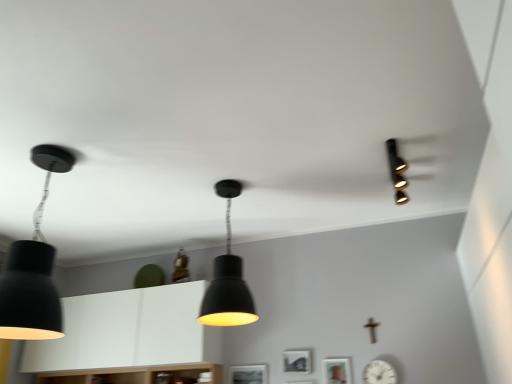
The height and width of the screenshot is (384, 512). I want to click on wooden picture frame at lower center, the 1th picture frame positioned from the right, so click(x=337, y=370).

Identify the location of white matte cabinet at center. (128, 331).

The width and height of the screenshot is (512, 384). What do you see at coordinates (297, 361) in the screenshot?
I see `black matte picture frame at center, which appears as the 2th picture frame when viewed from the right` at bounding box center [297, 361].

This screenshot has width=512, height=384. I want to click on matte black lampshade at center, acting as the second lamp starting from the left, so click(227, 277).

Describe the element at coordinates (249, 374) in the screenshot. The height and width of the screenshot is (384, 512). I see `matte black picture frame at center, the third picture frame in the right-to-left sequence` at that location.

This screenshot has width=512, height=384. In order to click on matte black picture frame at center, the third picture frame in the right-to-left sequence in this screenshot , I will do `click(249, 374)`.

Image resolution: width=512 pixels, height=384 pixels. Describe the element at coordinates (34, 268) in the screenshot. I see `matte black pendant light at left, the first lamp positioned from the left` at that location.

Image resolution: width=512 pixels, height=384 pixels. Describe the element at coordinates (379, 373) in the screenshot. I see `white matte clock at lower right` at that location.

Image resolution: width=512 pixels, height=384 pixels. Find the location of `wooden picture frame at lower center, which is the third picture frame from left to right`. wooden picture frame at lower center, which is the third picture frame from left to right is located at coordinates (337, 370).

Who is smaller, wooden picture frame at lower center, the 1th picture frame positioned from the right, or matte black lampshade at center, which is the second lamp in right-to-left order?

wooden picture frame at lower center, the 1th picture frame positioned from the right, is smaller.

Considering the points (325, 376) and (218, 284), which point is behind, point (325, 376) or point (218, 284)?

Positioned behind is point (325, 376).

From a real-world perspective, is wooden picture frame at lower center, the 1th picture frame positioned from the right, on top of matte black lampshade at center, which is the second lamp in right-to-left order?

Incorrect, from a real-world perspective, wooden picture frame at lower center, the 1th picture frame positioned from the right, is lower than matte black lampshade at center, which is the second lamp in right-to-left order.

Could you tell me if matte black spotlight at upper right, which is counted as the third lamp, starting from the left, is turned towards black matte picture frame at center, placed as the 2th picture frame when sorted from left to right?

No.

From a real-world perspective, is matte black spotlight at upper right, which is counted as the third lamp, starting from the left, over black matte picture frame at center, placed as the 2th picture frame when sorted from left to right?

Indeed, from a real-world perspective, matte black spotlight at upper right, which is counted as the third lamp, starting from the left, stands above black matte picture frame at center, placed as the 2th picture frame when sorted from left to right.

Between matte black spotlight at upper right, the 1th lamp in the right-to-left sequence, and black matte picture frame at center, placed as the 2th picture frame when sorted from left to right, which one has smaller width?

black matte picture frame at center, placed as the 2th picture frame when sorted from left to right, is thinner.

From the matte black spotlight at upper right, which is counted as the third lamp, starting from the left, count the 2nd picture frame to the left and point to it. Please provide its 2D coordinates.

[(297, 361)]

Between matte black spotlight at upper right, which is counted as the third lamp, starting from the left, and matte black pendant light at left, which is the third lamp in right-to-left order, which one has smaller width?

matte black pendant light at left, which is the third lamp in right-to-left order.

Can you tell me how much matte black spotlight at upper right, which is counted as the third lamp, starting from the left, and matte black pendant light at left, which is the third lamp in right-to-left order, differ in facing direction?

matte black spotlight at upper right, which is counted as the third lamp, starting from the left, and matte black pendant light at left, which is the third lamp in right-to-left order, are facing 1.23 degrees away from each other.

Is matte black spotlight at upper right, the 1th lamp in the right-to-left sequence, next to matte black pendant light at left, the first lamp positioned from the left?

No, matte black spotlight at upper right, the 1th lamp in the right-to-left sequence, is not in contact with matte black pendant light at left, the first lamp positioned from the left.

Between matte black spotlight at upper right, the 1th lamp in the right-to-left sequence, and matte black pendant light at left, the first lamp positioned from the left, which one appears on the right side from the viewer's perspective?

matte black spotlight at upper right, the 1th lamp in the right-to-left sequence.

From the image's perspective, which is below, black matte picture frame at center, which appears as the 2th picture frame when viewed from the right, or matte black pendant light at left, the first lamp positioned from the left?

black matte picture frame at center, which appears as the 2th picture frame when viewed from the right.

Could you tell me if black matte picture frame at center, which appears as the 2th picture frame when viewed from the right, is turned towards matte black pendant light at left, which is the third lamp in right-to-left order?

No.

Considering the relative sizes of black matte picture frame at center, which appears as the 2th picture frame when viewed from the right, and matte black pendant light at left, the first lamp positioned from the left, in the image provided, is black matte picture frame at center, which appears as the 2th picture frame when viewed from the right, shorter than matte black pendant light at left, the first lamp positioned from the left,?

Correct, black matte picture frame at center, which appears as the 2th picture frame when viewed from the right, is not as tall as matte black pendant light at left, the first lamp positioned from the left.

From a real-world perspective, which picture frame is the 1st one underneath the matte black pendant light at left, which is the third lamp in right-to-left order? Please provide its 2D coordinates.

[(297, 361)]

Is white matte cabinet at center aimed at wooden picture frame at lower center, which is the third picture frame from left to right?

No, white matte cabinet at center is not aimed at wooden picture frame at lower center, which is the third picture frame from left to right.

What's the angular difference between white matte cabinet at center and wooden picture frame at lower center, the 1th picture frame positioned from the right,'s facing directions?

They differ by 1.04 degrees in their facing directions.

Which object is closer to the camera taking this photo, white matte cabinet at center or wooden picture frame at lower center, which is the third picture frame from left to right?

wooden picture frame at lower center, which is the third picture frame from left to right.

Which of these two, white matte cabinet at center or wooden picture frame at lower center, which is the third picture frame from left to right, is thinner?

With smaller width is wooden picture frame at lower center, which is the third picture frame from left to right.

Consider the image. Looking at the image, does matte black pendant light at left, which is the third lamp in right-to-left order, seem bigger or smaller compared to black matte picture frame at center, which appears as the 2th picture frame when viewed from the right?

Considering their sizes, matte black pendant light at left, which is the third lamp in right-to-left order, takes up more space than black matte picture frame at center, which appears as the 2th picture frame when viewed from the right.

Where is `the 2nd lamp to the left of the black matte picture frame at center, placed as the 2th picture frame when sorted from left to right, starting your count from the anchor`? The height and width of the screenshot is (384, 512). the 2nd lamp to the left of the black matte picture frame at center, placed as the 2th picture frame when sorted from left to right, starting your count from the anchor is located at coordinates coord(34,268).

Who is taller, matte black pendant light at left, the first lamp positioned from the left, or black matte picture frame at center, placed as the 2th picture frame when sorted from left to right?

With more height is matte black pendant light at left, the first lamp positioned from the left.

How different are the orientations of matte black pendant light at left, which is the third lamp in right-to-left order, and black matte picture frame at center, placed as the 2th picture frame when sorted from left to right, in degrees?

There is a 1.99-degree angle between the facing directions of matte black pendant light at left, which is the third lamp in right-to-left order, and black matte picture frame at center, placed as the 2th picture frame when sorted from left to right.

Is matte black pendant light at left, the first lamp positioned from the left, not within matte black lampshade at center, acting as the second lamp starting from the left?

Yes, matte black pendant light at left, the first lamp positioned from the left, is located beyond the bounds of matte black lampshade at center, acting as the second lamp starting from the left.

From the image's perspective, which lamp is the 1st one above the matte black lampshade at center, acting as the second lamp starting from the left? Please provide its 2D coordinates.

[(34, 268)]

Is matte black pendant light at left, which is the third lamp in right-to-left order, far away from matte black lampshade at center, acting as the second lamp starting from the left?

Yes, matte black pendant light at left, which is the third lamp in right-to-left order, and matte black lampshade at center, acting as the second lamp starting from the left, are quite far apart.

From a real-world perspective, which object rests below the other?

In real-world perspective, matte black pendant light at left, which is the third lamp in right-to-left order, is lower.

I want to click on the 3rd picture frame to the right when counting from the matte black lampshade at center, acting as the second lamp starting from the left, so click(x=337, y=370).

The width and height of the screenshot is (512, 384). Find the location of `the 3rd lamp above the black matte picture frame at center, which appears as the 2th picture frame when viewed from the right (from a real-world perspective)`. the 3rd lamp above the black matte picture frame at center, which appears as the 2th picture frame when viewed from the right (from a real-world perspective) is located at coordinates (397, 171).

Based on their spatial positions, is matte black spotlight at upper right, the 1th lamp in the right-to-left sequence, or matte black lampshade at center, acting as the second lamp starting from the left, closer to white matte cabinet at center?

matte black lampshade at center, acting as the second lamp starting from the left, lies closer to white matte cabinet at center than the other object.

When comparing their distances from matte black spotlight at upper right, which is counted as the third lamp, starting from the left, does matte black picture frame at center, positioned as the 1th picture frame in left-to-right order, or matte black pendant light at left, which is the third lamp in right-to-left order, seem closer?

matte black picture frame at center, positioned as the 1th picture frame in left-to-right order.

Which object lies further to the anchor point matte black spotlight at upper right, which is counted as the third lamp, starting from the left, white matte clock at lower right or white matte cabinet at center?

white matte cabinet at center is positioned further to the anchor matte black spotlight at upper right, which is counted as the third lamp, starting from the left.

Which object lies further to the anchor point white matte cabinet at center, black matte picture frame at center, which appears as the 2th picture frame when viewed from the right, or white matte clock at lower right?

Based on the image, white matte clock at lower right appears to be further to white matte cabinet at center.

When comparing their distances from wooden picture frame at lower center, which is the third picture frame from left to right, does black matte picture frame at center, placed as the 2th picture frame when sorted from left to right, or matte black spotlight at upper right, which is counted as the third lamp, starting from the left, seem further?

Among the two, matte black spotlight at upper right, which is counted as the third lamp, starting from the left, is located further to wooden picture frame at lower center, which is the third picture frame from left to right.

Based on their spatial positions, is matte black lampshade at center, which is the second lamp in right-to-left order, or matte black pendant light at left, which is the third lamp in right-to-left order, closer to wooden picture frame at lower center, which is the third picture frame from left to right?

The object closer to wooden picture frame at lower center, which is the third picture frame from left to right, is matte black lampshade at center, which is the second lamp in right-to-left order.

Looking at the image, which one is located closer to matte black spotlight at upper right, the 1th lamp in the right-to-left sequence, black matte picture frame at center, placed as the 2th picture frame when sorted from left to right, or matte black lampshade at center, which is the second lamp in right-to-left order?

Based on the image, matte black lampshade at center, which is the second lamp in right-to-left order, appears to be nearer to matte black spotlight at upper right, the 1th lamp in the right-to-left sequence.

Based on their spatial positions, is matte black spotlight at upper right, the 1th lamp in the right-to-left sequence, or matte black pendant light at left, which is the third lamp in right-to-left order, further from white matte clock at lower right?

matte black pendant light at left, which is the third lamp in right-to-left order, is further to white matte clock at lower right.

Locate an element on the screen. Image resolution: width=512 pixels, height=384 pixels. cabinetry situated between matte black pendant light at left, which is the third lamp in right-to-left order, and black matte picture frame at center, which appears as the 2th picture frame when viewed from the right, from left to right is located at coordinates (128, 331).

Locate an element on the screen. This screenshot has height=384, width=512. lamp situated between matte black pendant light at left, the first lamp positioned from the left, and wooden picture frame at lower center, which is the third picture frame from left to right, from left to right is located at coordinates (227, 277).

Where is `picture frame between matte black lampshade at center, acting as the second lamp starting from the left, and wooden picture frame at lower center, the 1th picture frame positioned from the right, vertically`? The image size is (512, 384). picture frame between matte black lampshade at center, acting as the second lamp starting from the left, and wooden picture frame at lower center, the 1th picture frame positioned from the right, vertically is located at coordinates (297, 361).

Locate an element on the screen. The image size is (512, 384). cabinetry located between matte black pendant light at left, the first lamp positioned from the left, and matte black picture frame at center, the third picture frame in the right-to-left sequence, in the depth direction is located at coordinates (128, 331).